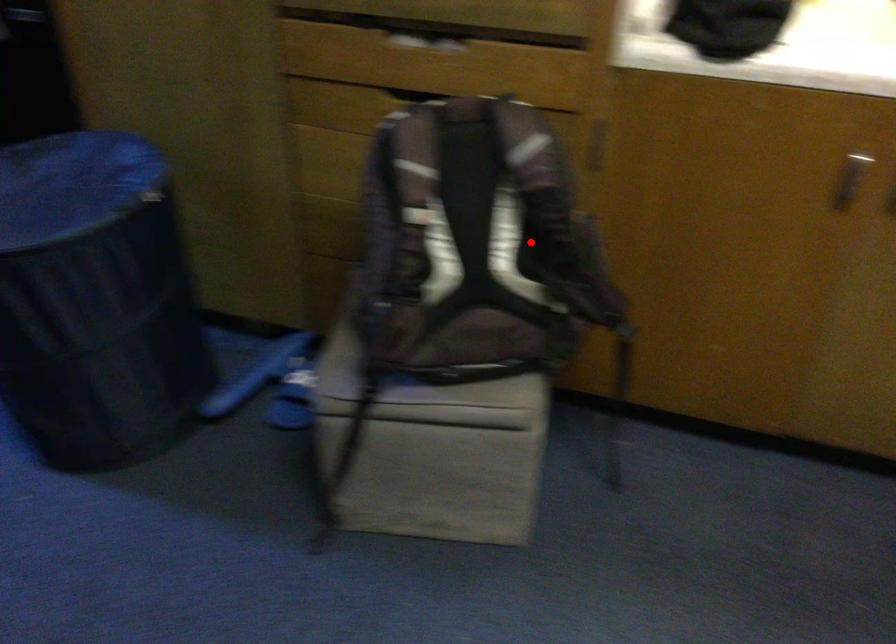
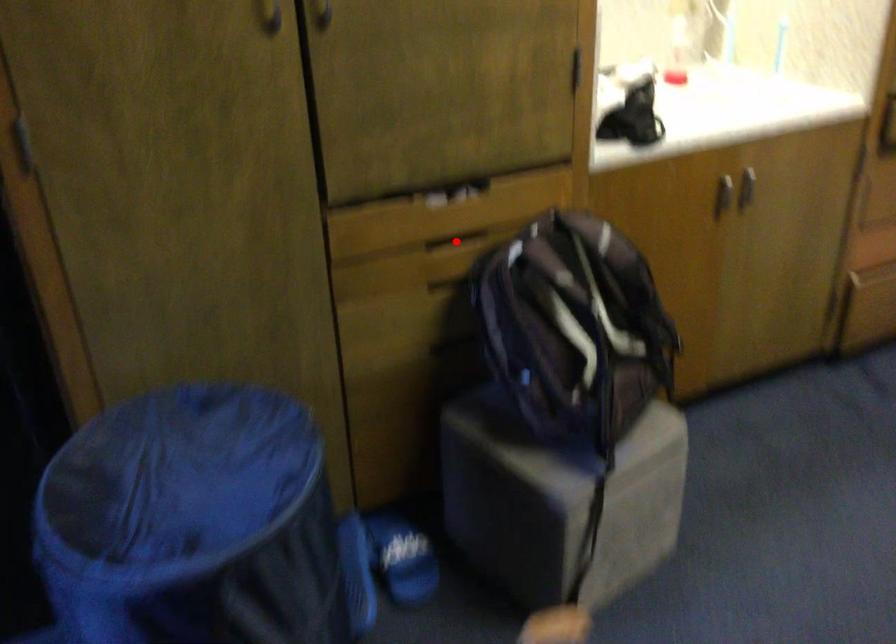
I am providing you with two images of the same scene from different viewpoints. A red point is marked on the first image and another point is marked on the second image. Do the highlighted points in image1 and image2 indicate the same real-world spot?

No